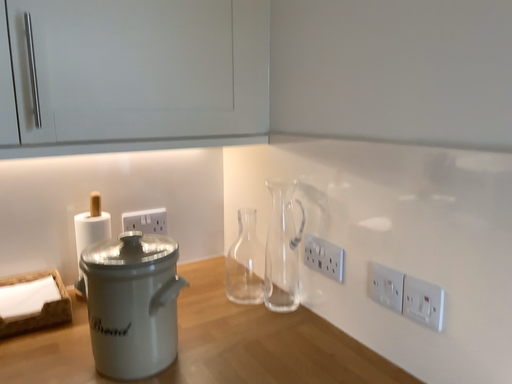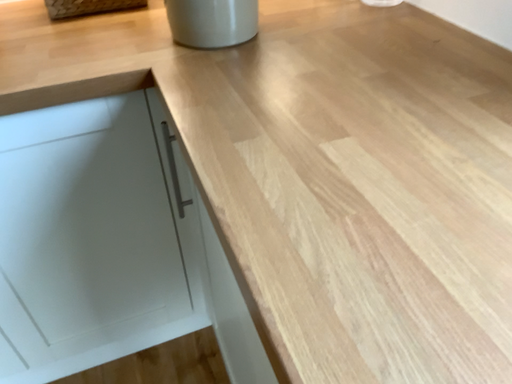
Question: Which way did the camera rotate in the video?

Choices:
 (A) rotated upward
 (B) rotated downward

Answer: (B)